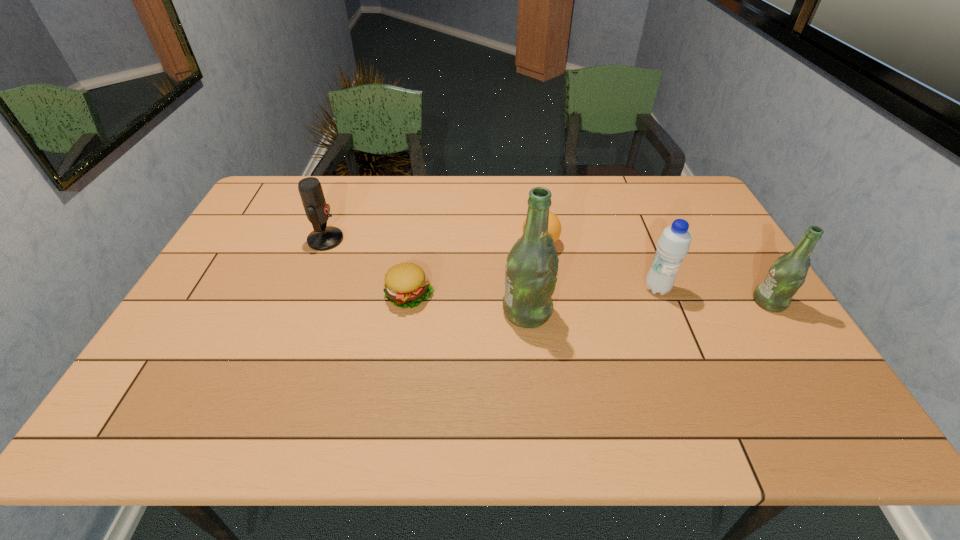
I want to click on free space located 0.270m on the side of the leftmost object with the red ring, so click(429, 240).

At what (x,y) coordinates should I click in order to perform the action: click on free space located 0.190m on the right of the water bottle. Please return your answer as a coordinate pair (x, y). Looking at the image, I should click on (739, 288).

Find the location of `vacant region located 0.070m on the left of the fifth object from right to left`. vacant region located 0.070m on the left of the fifth object from right to left is located at coordinates (359, 295).

I want to click on blank area located 0.250m on the side with brand of the second shortest object, so click(441, 244).

Image resolution: width=960 pixels, height=540 pixels. What are the coordinates of `vacant space located on the side with brand of the second shortest object` in the screenshot? It's located at (480, 244).

Image resolution: width=960 pixels, height=540 pixels. I want to click on vacant space situated on the side with brand of the second shortest object, so click(x=490, y=244).

This screenshot has height=540, width=960. What are the coordinates of `object located in the right edge section of the desktop` in the screenshot? It's located at (787, 274).

The height and width of the screenshot is (540, 960). Identify the location of free space at the far edge. (552, 191).

Find the location of `vacant space at the near edge of the desktop`. vacant space at the near edge of the desktop is located at coordinates (385, 380).

The height and width of the screenshot is (540, 960). In the image, there is a desktop. Identify the location of vacant region at the left edge. (263, 261).